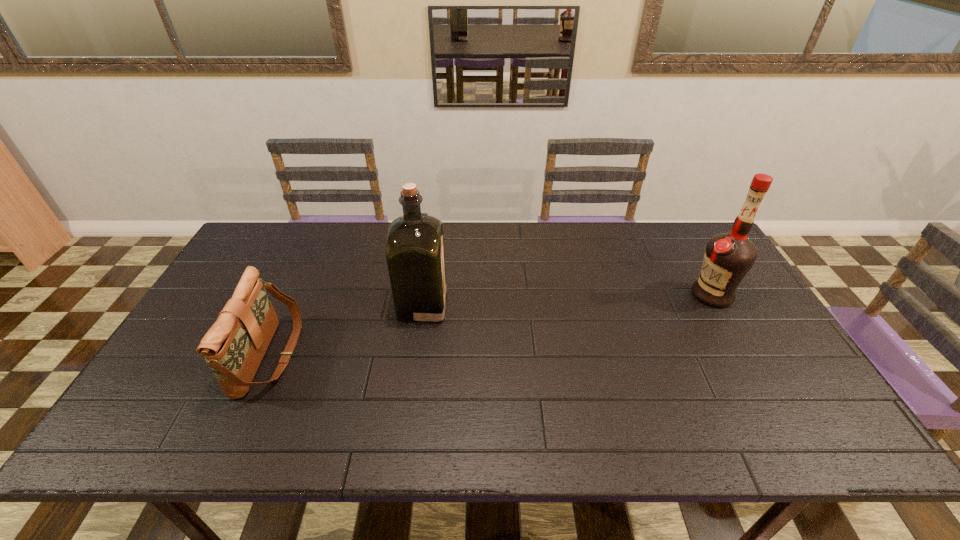
Where is `the right liquor`? the right liquor is located at coordinates (728, 257).

This screenshot has width=960, height=540. In order to click on the left liquor in this screenshot , I will do `click(415, 256)`.

The height and width of the screenshot is (540, 960). Identify the location of the shortest object. pos(234,346).

Where is `the leftmost object`? the leftmost object is located at coordinates (234, 346).

Locate an element on the screen. The image size is (960, 540). free spot located on the front and back of the right liquor is located at coordinates (597, 294).

This screenshot has height=540, width=960. I want to click on free space located on the front and back of the right liquor, so (x=631, y=294).

The width and height of the screenshot is (960, 540). I want to click on vacant space located on the front and back of the right liquor, so click(x=631, y=294).

At what (x,y) coordinates should I click in order to perform the action: click on vacant space located 0.340m on the label of the second object from left to right. Please return your answer as a coordinate pair (x, y). The width and height of the screenshot is (960, 540). Looking at the image, I should click on (563, 304).

Find the location of a particular element. The image size is (960, 540). free space located on the front-facing side of the shoulder bag is located at coordinates (386, 355).

This screenshot has width=960, height=540. I want to click on object at the right edge, so click(728, 257).